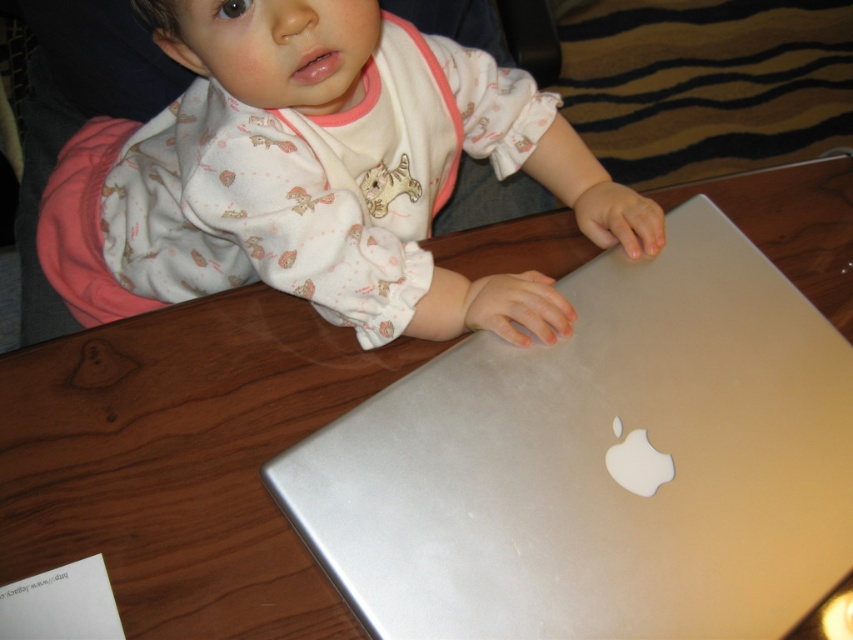
Between point (759, 532) and point (84, 196), which one is positioned behind?

Positioned behind is point (84, 196).

Does silver metallic laptop at center lie behind matte white baby at upper left?

Yes, it is behind matte white baby at upper left.

Locate an element on the screen. The image size is (853, 640). silver metallic laptop at center is located at coordinates (601, 464).